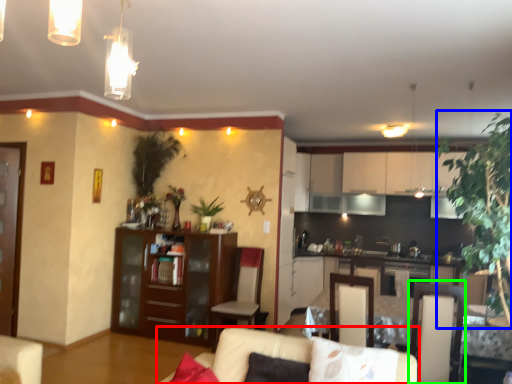
Question: Which object is the closest to the studio couch (highlighted by a red box)? Choose among these: plant (highlighted by a blue box) or armchair (highlighted by a green box).

Choices:
 (A) plant
 (B) armchair

Answer: (B)